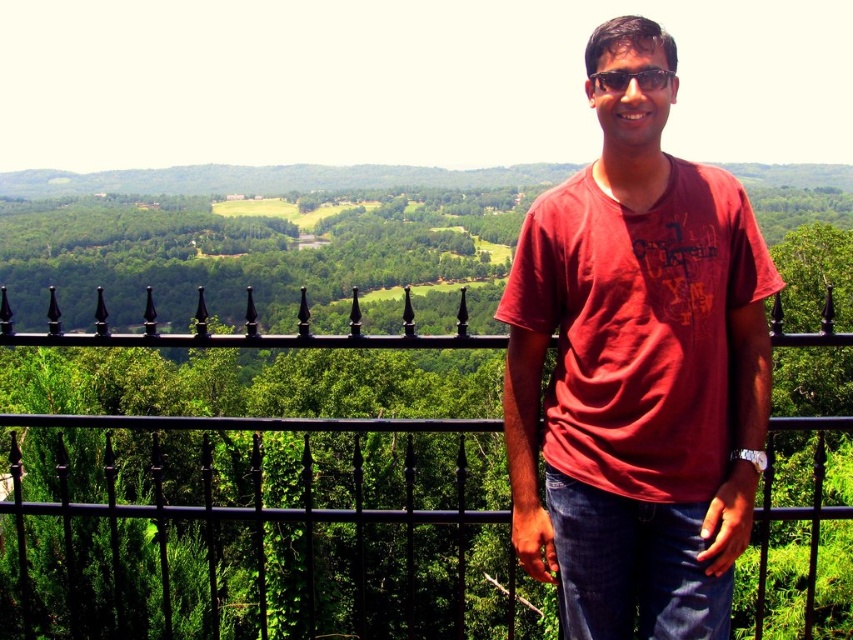
Between matte red t-shirt at center and black wrought iron fence at center, which one is positioned lower?

black wrought iron fence at center is below.

Who is more distant from viewer, (541,304) or (109,465)?

Positioned behind is point (109,465).

The width and height of the screenshot is (853, 640). I want to click on matte red t-shirt at center, so click(637, 365).